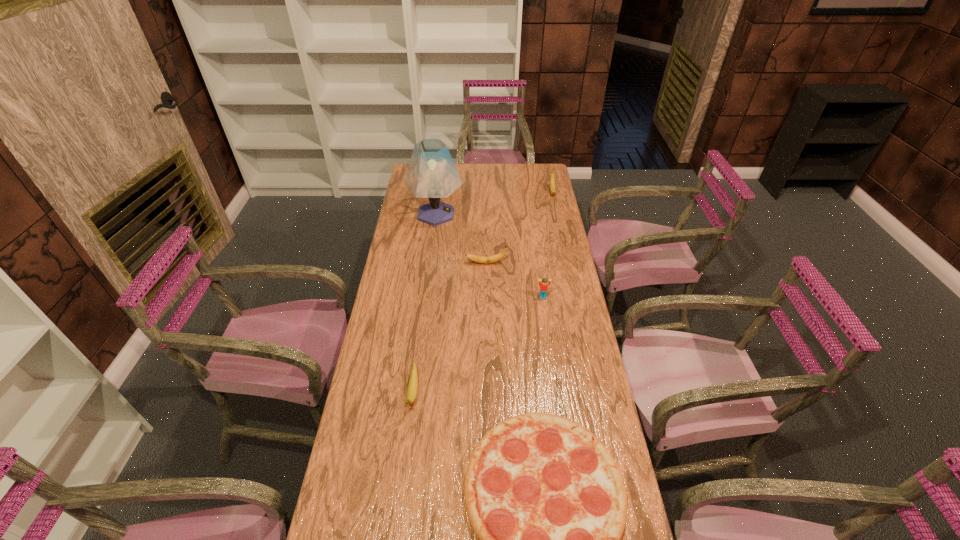
Identify the location of lampshade. The image size is (960, 540). (432, 174).

Identify the location of the tallest object. (432, 174).

Where is `the tallest banana`? The height and width of the screenshot is (540, 960). the tallest banana is located at coordinates (552, 177).

Locate an element on the screen. This screenshot has width=960, height=540. the fifth shortest object is located at coordinates (552, 177).

Where is `the second banana from left to right`? The width and height of the screenshot is (960, 540). the second banana from left to right is located at coordinates (494, 258).

Locate an element on the screen. The width and height of the screenshot is (960, 540). the second tallest banana is located at coordinates (494, 258).

The width and height of the screenshot is (960, 540). Identify the location of Lego. (544, 284).

Image resolution: width=960 pixels, height=540 pixels. I want to click on the second shortest object, so [x=413, y=382].

The width and height of the screenshot is (960, 540). I want to click on the shortest banana, so click(413, 382).

Locate an element on the screen. The width and height of the screenshot is (960, 540). blank space located 0.210m on the base of the tallest object is located at coordinates (509, 214).